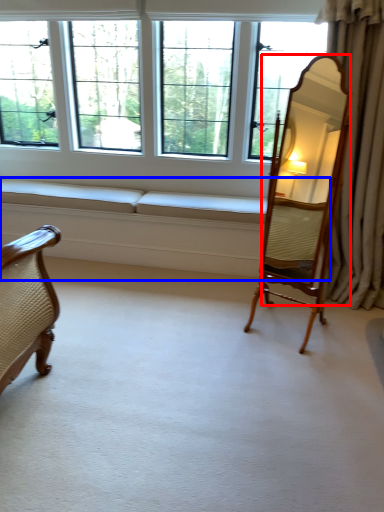
Question: Which object is closer to the camera taking this photo, mirror (highlighted by a red box) or couch (highlighted by a blue box)?

Choices:
 (A) mirror
 (B) couch

Answer: (A)